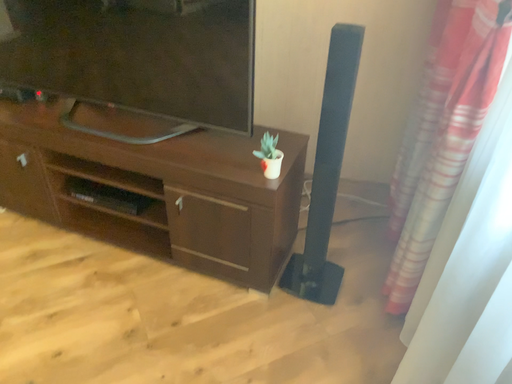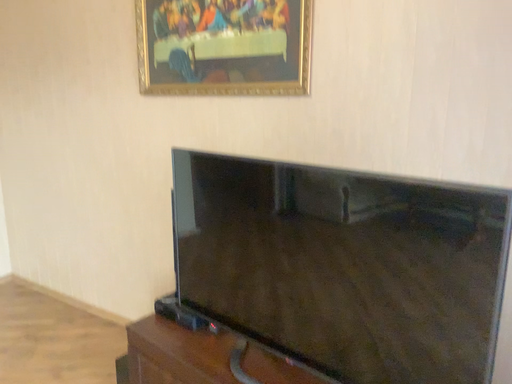
Question: How did the camera likely rotate when shooting the video?

Choices:
 (A) rotated left
 (B) rotated right

Answer: (A)